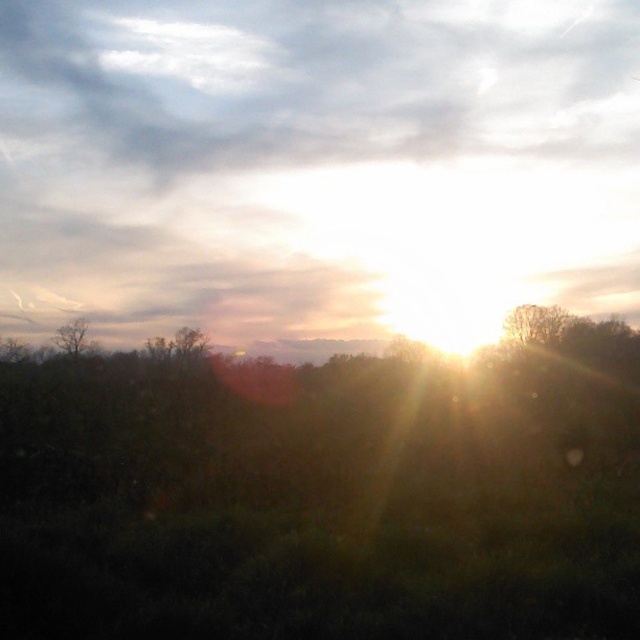
You are an astronomer analyzing the sunset scene. You notice the bare branches at center in the image. Can you determine their exact 2D coordinates based on the image grid?

The 2D coordinates of the bare branches at center are at point (532, 324).

Based on the photo, you are an observer standing in the forest facing the sunset. You notice two sets of bare branches in your view. Which set of bare branches, the bare branches at center or the bare branches at left, is closer to you?

The bare branches at center is positioned under the bare branches at left, so the bare branches at center is closer to you.